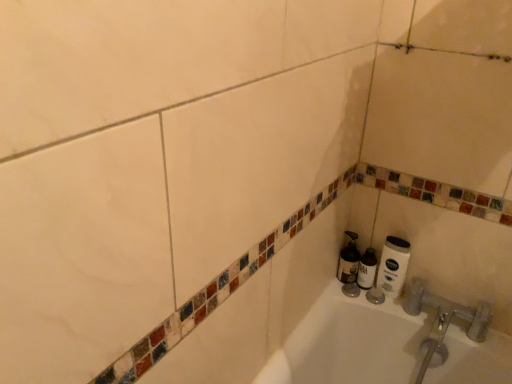
Question: In the image, is white matte shaving cream at lower right, the 2th shaving cream from the right, positioned in front of or behind white matte toilet paper at lower right?

Choices:
 (A) behind
 (B) front

Answer: (A)

Question: Is white matte shaving cream at lower right, the 2th shaving cream from the right, taller or shorter than white matte toilet paper at lower right?

Choices:
 (A) short
 (B) tall

Answer: (A)

Question: Estimate the real-world distances between objects in this image. Which object is farther from the white matte shaving cream at lower right, placed as the first shaving cream when sorted from right to left?

Choices:
 (A) white matte shaving cream at lower right, which appears as the first shaving cream when viewed from the left
 (B) white matte toilet paper at lower right

Answer: (B)

Question: Based on their relative distances, which object is farther from the white matte toilet paper at lower right?

Choices:
 (A) white matte shaving cream at lower right, the 2th shaving cream from the right
 (B) white matte shaving cream at lower right, which is the 2th shaving cream in left-to-right order

Answer: (A)